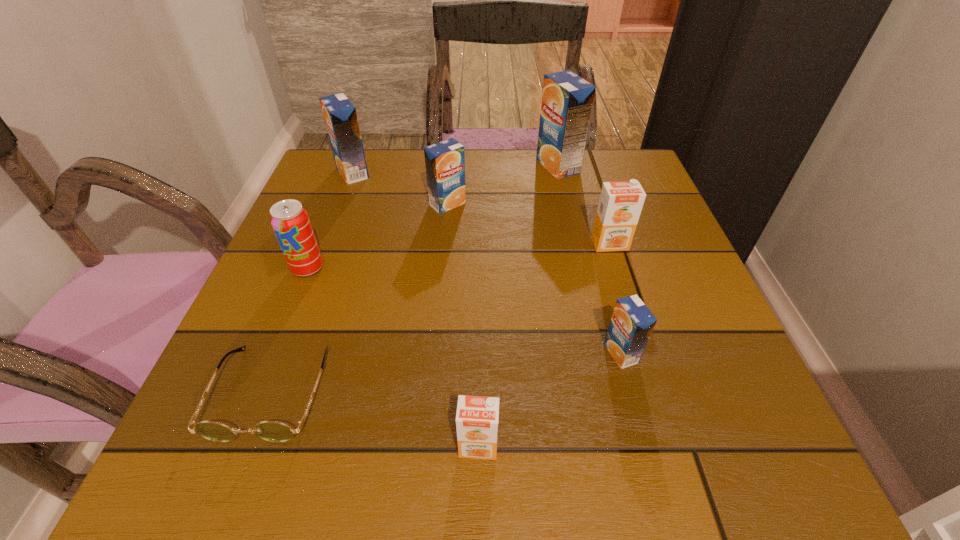
Where is `the biggest blue orange_juice`? The width and height of the screenshot is (960, 540). the biggest blue orange_juice is located at coordinates (567, 99).

You are a GUI agent. You are given a task and a screenshot of the screen. Output one action in this format:
    pyautogui.click(x=<x>, y=<y>)
    Task: Click on the tallest object
    
    Given the screenshot: What is the action you would take?
    pyautogui.click(x=567, y=99)

The height and width of the screenshot is (540, 960). In order to click on the second tallest orange juice in this screenshot , I will do point(340,116).

Image resolution: width=960 pixels, height=540 pixels. Identify the location of the leftmost blue orange_juice. coord(340,116).

This screenshot has width=960, height=540. I want to click on the third blue orange_juice from right to left, so click(445, 161).

Find the location of `the third farthest orange juice`. the third farthest orange juice is located at coordinates (445, 161).

Locate an element on the screen. the right orange orange juice is located at coordinates [620, 204].

I want to click on the farther orange orange juice, so click(620, 204).

Identify the location of the fifth farthest object. (290, 221).

Locate an element on the screen. the smallest blue orange_juice is located at coordinates (631, 325).